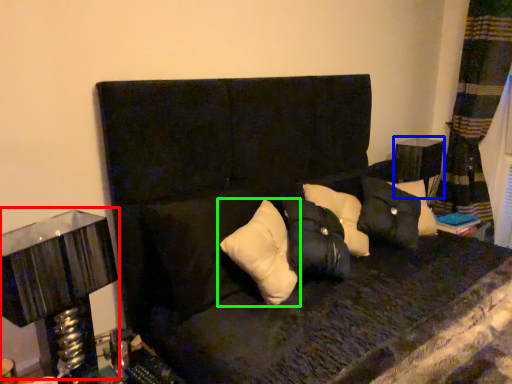
Question: Which object is positioned closest to table lamp (highlighted by a red box)? Select from table (highlighted by a blue box) and pillow (highlighted by a green box).

Choices:
 (A) table
 (B) pillow

Answer: (B)